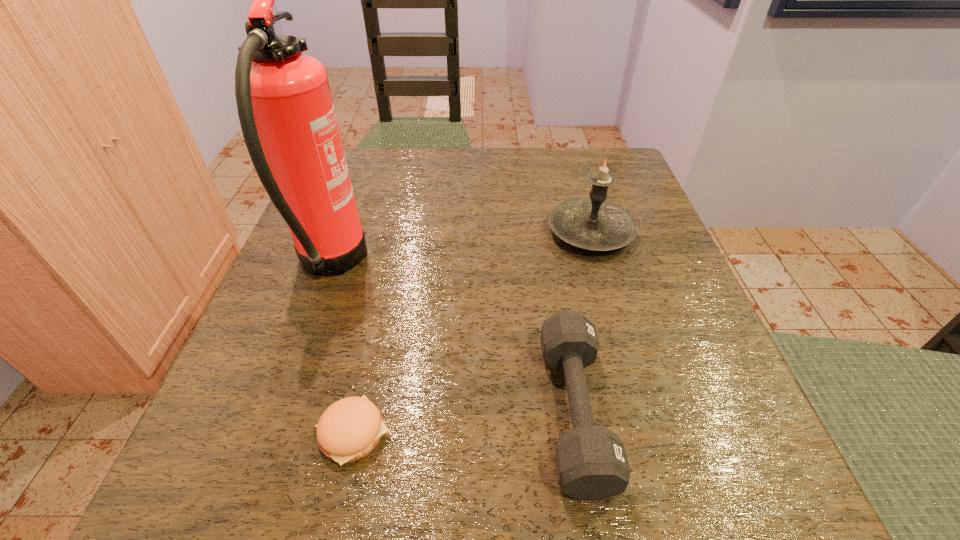
This screenshot has height=540, width=960. Find the location of `free spot that satisfies the following two spatial constraints: 1. on the back side of the third tallest object; 2. on the right side of the candle`. free spot that satisfies the following two spatial constraints: 1. on the back side of the third tallest object; 2. on the right side of the candle is located at coordinates (544, 232).

In order to click on free space that satisfies the following two spatial constraints: 1. on the back side of the shortest object; 2. on the right side of the third shortest object in this screenshot , I will do `click(397, 232)`.

Locate an element on the screen. blank space that satisfies the following two spatial constraints: 1. at the nozzle of the tallest object; 2. on the right side of the second shortest object is located at coordinates (277, 411).

Where is `vacant space that satisfies the following two spatial constraints: 1. at the nozzle of the tallest object; 2. on the back side of the dumbbell`? The image size is (960, 540). vacant space that satisfies the following two spatial constraints: 1. at the nozzle of the tallest object; 2. on the back side of the dumbbell is located at coordinates (277, 411).

Where is `vacant space that satisfies the following two spatial constraints: 1. at the nozzle of the dumbbell; 2. on the left side of the tallest object`? vacant space that satisfies the following two spatial constraints: 1. at the nozzle of the dumbbell; 2. on the left side of the tallest object is located at coordinates (277, 411).

Locate an element on the screen. vacant space that satisfies the following two spatial constraints: 1. at the nozzle of the fire extinguisher; 2. on the left side of the second shortest object is located at coordinates (277, 411).